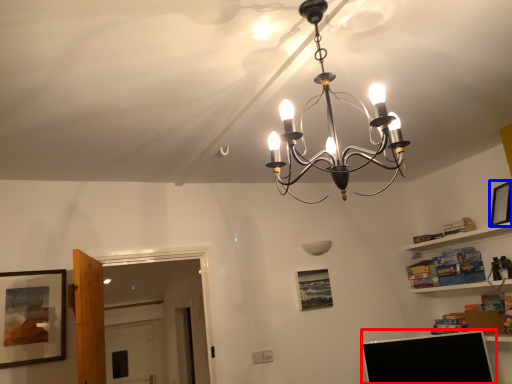
Question: Which object appears closest to the camera in this image, computer monitor (highlighted by a red box) or picture frame (highlighted by a blue box)?

Choices:
 (A) computer monitor
 (B) picture frame

Answer: (A)